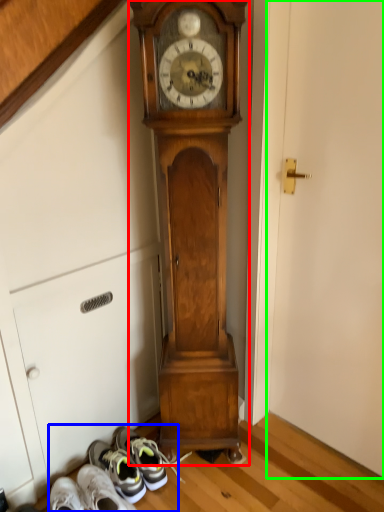
Question: Which object is positioned farthest from wall clock (highlighted by a red box)? Select from shoe (highlighted by a blue box) and door (highlighted by a green box).

Choices:
 (A) shoe
 (B) door

Answer: (A)